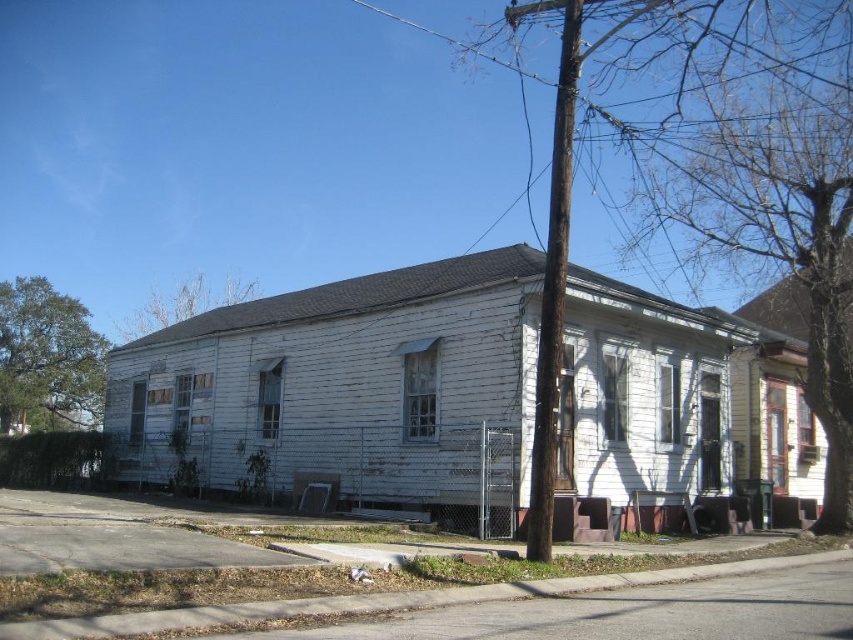
I want to click on bare wood tree at upper right, so click(775, 225).

Does bare wood tree at upper right appear on the right side of brown leafy tree at upper left?

Indeed, bare wood tree at upper right is positioned on the right side of brown leafy tree at upper left.

Which is behind, point (817, 179) or point (148, 337)?

The point (148, 337) is more distant.

Where is `bare wood tree at upper right`? The height and width of the screenshot is (640, 853). bare wood tree at upper right is located at coordinates (775, 225).

Find the location of a particular element. The width and height of the screenshot is (853, 640). green leafy tree at left is located at coordinates (47, 356).

Who is lower down, green leafy tree at left or brown leafy tree at upper left?

Positioned lower is green leafy tree at left.

You are a GUI agent. You are given a task and a screenshot of the screen. Output one action in this format:
    pyautogui.click(x=<x>, y=<y>)
    Task: Click on the green leafy tree at left
    
    Given the screenshot: What is the action you would take?
    click(47, 356)

Find the location of `green leafy tree at left`. green leafy tree at left is located at coordinates (47, 356).

Who is positioned more to the left, bare wood tree at upper right or green leafy tree at left?

From the viewer's perspective, green leafy tree at left appears more on the left side.

Is bare wood tree at upper right positioned at the back of green leafy tree at left?

No, bare wood tree at upper right is closer to the viewer.

Locate an element on the screen. This screenshot has height=640, width=853. bare wood tree at upper right is located at coordinates (775, 225).